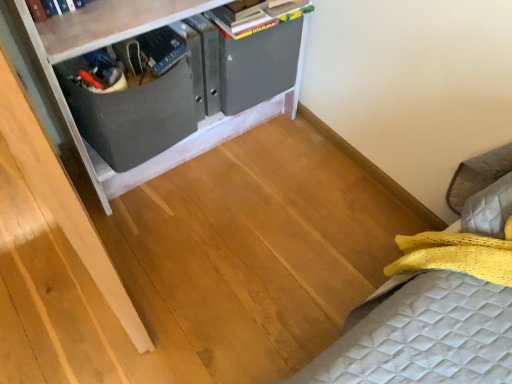
Find the location of a particular element. This screenshot has width=512, height=384. vacant area that lies to the right of matte gray cabinet at upper left is located at coordinates (308, 186).